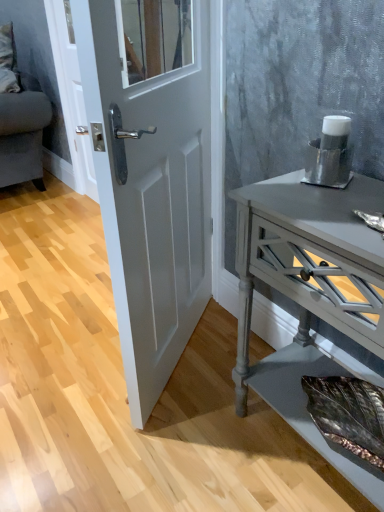
Question: Can you confirm if white glossy door at center is smaller than silver metallic cup at right?

Choices:
 (A) yes
 (B) no

Answer: (B)

Question: Can you confirm if white glossy door at center is taller than silver metallic cup at right?

Choices:
 (A) yes
 (B) no

Answer: (A)

Question: From a real-world perspective, is white glossy door at center positioned over silver metallic cup at right based on gravity?

Choices:
 (A) yes
 (B) no

Answer: (B)

Question: Considering the relative positions of white glossy door at center and silver metallic cup at right in the image provided, is white glossy door at center behind silver metallic cup at right?

Choices:
 (A) yes
 (B) no

Answer: (B)

Question: Could you tell me if white glossy door at center is facing silver metallic cup at right?

Choices:
 (A) yes
 (B) no

Answer: (A)

Question: Does white glossy door at center contain silver metallic cup at right?

Choices:
 (A) no
 (B) yes

Answer: (A)

Question: Does velvet grey couch at upper left have a lesser height compared to white glossy door at center?

Choices:
 (A) yes
 (B) no

Answer: (A)

Question: From the image's perspective, is velvet grey couch at upper left beneath white glossy door at center?

Choices:
 (A) no
 (B) yes

Answer: (A)

Question: Is velvet grey couch at upper left taller than white glossy door at center?

Choices:
 (A) no
 (B) yes

Answer: (A)

Question: Is velvet grey couch at upper left not within white glossy door at center?

Choices:
 (A) no
 (B) yes

Answer: (B)

Question: Does velvet grey couch at upper left have a lesser width compared to white glossy door at center?

Choices:
 (A) yes
 (B) no

Answer: (B)

Question: Is white glossy door at center at the back of velvet grey couch at upper left?

Choices:
 (A) yes
 (B) no

Answer: (B)

Question: From the image's perspective, does white glossy door at center appear lower than velvet grey couch at upper left?

Choices:
 (A) yes
 (B) no

Answer: (A)